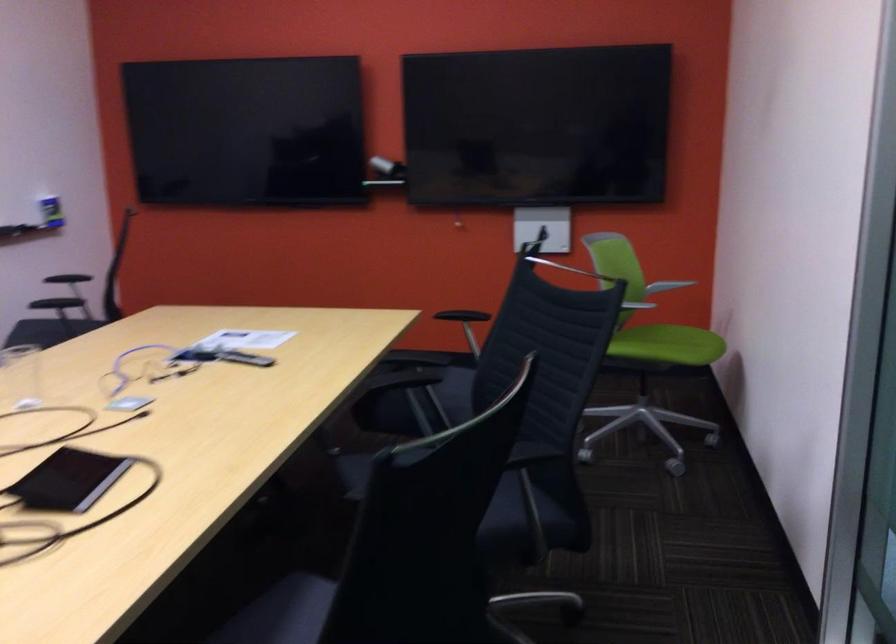
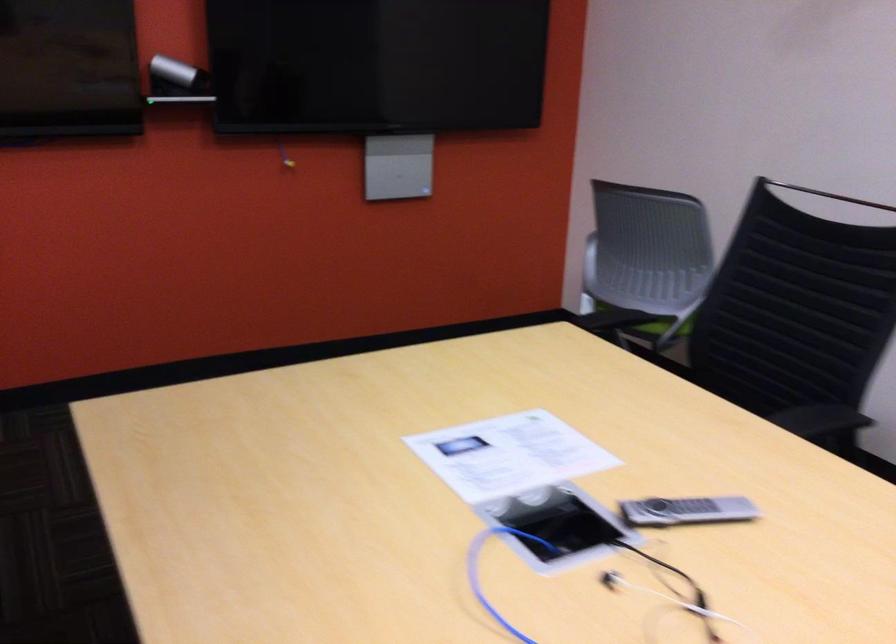
Locate, in the second image, the point that corresponds to pixel 252 360 in the first image.

(686, 511)